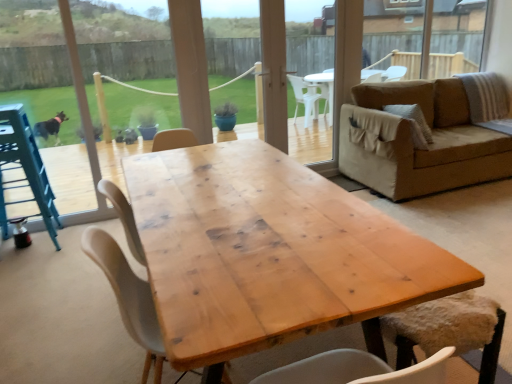
Describe the element at coordinates (128, 297) in the screenshot. Image resolution: width=512 pixels, height=384 pixels. I see `white matte chair at center, which is the second chair in right-to-left order` at that location.

Where is `natural wood table at center`? Image resolution: width=512 pixels, height=384 pixels. natural wood table at center is located at coordinates (270, 254).

Identify the location of transparent plastic screen door at center. The width and height of the screenshot is (512, 384). (274, 73).

Is point (284, 95) positioned behind point (22, 129)?

Yes.

Can you confirm if transparent plastic screen door at center is smaller than metallic blue feeding chair at left?

Correct, transparent plastic screen door at center occupies less space than metallic blue feeding chair at left.

Which of these two, transparent plastic screen door at center or metallic blue feeding chair at left, is wider?

Wider between the two is metallic blue feeding chair at left.

Locate an element on the screen. This screenshot has height=384, width=512. screen door to the right of metallic blue feeding chair at left is located at coordinates (274, 73).

From the image's perspective, is white matte chair at center, which is the second chair in right-to-left order, above or below transparent plastic screen door at center?

From the image's perspective, white matte chair at center, which is the second chair in right-to-left order, appears below transparent plastic screen door at center.

Considering the relative positions of white matte chair at center, which is the second chair in right-to-left order, and transparent plastic screen door at center in the image provided, is white matte chair at center, which is the second chair in right-to-left order, to the right of transparent plastic screen door at center from the viewer's perspective?

In fact, white matte chair at center, which is the second chair in right-to-left order, is to the left of transparent plastic screen door at center.

Looking at this image, considering the relative sizes of white matte chair at center, the first chair in the left-to-right sequence, and transparent plastic screen door at center in the image provided, is white matte chair at center, the first chair in the left-to-right sequence, shorter than transparent plastic screen door at center?

Indeed, white matte chair at center, the first chair in the left-to-right sequence, has a lesser height compared to transparent plastic screen door at center.

Based on the photo, can we say white matte chair at center, which is the second chair in right-to-left order, lies outside transparent plastic screen door at center?

white matte chair at center, which is the second chair in right-to-left order, is positioned outside transparent plastic screen door at center.

Looking at this image, is metallic blue feeding chair at left not within fuzzy white chair at lower right, arranged as the second chair when viewed from the left?

Yes.

The height and width of the screenshot is (384, 512). In order to click on feeding chair located on the left of fuzzy white chair at lower right, arranged as the second chair when viewed from the left in this screenshot , I will do `click(24, 169)`.

Is point (30, 169) positioned in front of point (467, 299)?

That is False.

Considering the positions of point (414, 322) and point (137, 331), is point (414, 322) closer or farther from the camera than point (137, 331)?

Clearly, point (414, 322) is more distant from the camera than point (137, 331).

Could you tell me if fuzzy white chair at lower right, the first chair positioned from the right, is turned towards white matte chair at center, which is the second chair in right-to-left order?

No, fuzzy white chair at lower right, the first chair positioned from the right, is not turned towards white matte chair at center, which is the second chair in right-to-left order.

You are a GUI agent. You are given a task and a screenshot of the screen. Output one action in this format:
    pyautogui.click(x=<x>, y=<y>)
    Task: Click on the chair below the fuzzy white chair at lower right, arranged as the second chair when viewed from the left (from the image's perspective)
    The image size is (512, 384).
    Given the screenshot: What is the action you would take?
    pyautogui.click(x=128, y=297)

Is fuzzy white chair at lower right, arranged as the second chair when viewed from the left, to the left of white matte chair at center, the first chair in the left-to-right sequence, from the viewer's perspective?

No, fuzzy white chair at lower right, arranged as the second chair when viewed from the left, is not to the left of white matte chair at center, the first chair in the left-to-right sequence.

Considering the positions of objects metallic blue feeding chair at left and white matte chair at center, the first chair in the left-to-right sequence, in the image provided, who is more to the right, metallic blue feeding chair at left or white matte chair at center, the first chair in the left-to-right sequence,?

white matte chair at center, the first chair in the left-to-right sequence.

Consider the image. Which object is thinner, metallic blue feeding chair at left or white matte chair at center, which is the second chair in right-to-left order?

With smaller width is metallic blue feeding chair at left.

Looking at this image, considering the relative sizes of metallic blue feeding chair at left and white matte chair at center, which is the second chair in right-to-left order, in the image provided, is metallic blue feeding chair at left smaller than white matte chair at center, which is the second chair in right-to-left order,?

No.

From a real-world perspective, which object stands above the other?

fuzzy white chair at lower right, the first chair positioned from the right.

Who is smaller, white matte chair at center, the first chair in the left-to-right sequence, or fuzzy white chair at lower right, the first chair positioned from the right?

fuzzy white chair at lower right, the first chair positioned from the right, is smaller.

Can you confirm if white matte chair at center, the first chair in the left-to-right sequence, is positioned to the left of fuzzy white chair at lower right, arranged as the second chair when viewed from the left?

Indeed, white matte chair at center, the first chair in the left-to-right sequence, is positioned on the left side of fuzzy white chair at lower right, arranged as the second chair when viewed from the left.

Is natural wood table at center located outside fuzzy white chair at lower right, the first chair positioned from the right?

Yes.

Does point (181, 164) appear closer or farther from the camera than point (395, 326)?

Point (181, 164) is positioned farther from the camera compared to point (395, 326).

How distant is natural wood table at center from fuzzy white chair at lower right, arranged as the second chair when viewed from the left?

25.94 inches.

This screenshot has width=512, height=384. I want to click on feeding chair lying in front of the transparent plastic screen door at center, so click(x=24, y=169).

Find the location of a particular element. the 2nd chair below the transparent plastic screen door at center (from the image's perspective) is located at coordinates (128, 297).

Considering their positions, is transparent plastic screen door at center positioned closer to white matte chair at center, the first chair in the left-to-right sequence, than fuzzy white chair at lower right, the first chair positioned from the right?

fuzzy white chair at lower right, the first chair positioned from the right, is closer to white matte chair at center, the first chair in the left-to-right sequence.

When comparing their distances from white matte chair at center, which is the second chair in right-to-left order, does metallic blue feeding chair at left or fuzzy white chair at lower right, the first chair positioned from the right, seem closer?

fuzzy white chair at lower right, the first chair positioned from the right, is positioned closer to the anchor white matte chair at center, which is the second chair in right-to-left order.

From the image, which object appears to be nearer to natural wood table at center, metallic blue feeding chair at left or white matte chair at center, which is the second chair in right-to-left order?

white matte chair at center, which is the second chair in right-to-left order, is positioned closer to the anchor natural wood table at center.

Based on their spatial positions, is fuzzy white chair at lower right, the first chair positioned from the right, or natural wood table at center closer to white matte chair at center, which is the second chair in right-to-left order?

Based on the image, natural wood table at center appears to be nearer to white matte chair at center, which is the second chair in right-to-left order.

Considering their positions, is natural wood table at center positioned closer to transparent plastic screen door at center than metallic blue feeding chair at left?

metallic blue feeding chair at left.

Looking at the image, which one is located closer to metallic blue feeding chair at left, transparent plastic screen door at center or fuzzy white chair at lower right, arranged as the second chair when viewed from the left?

transparent plastic screen door at center is closer to metallic blue feeding chair at left.

Based on their spatial positions, is natural wood table at center or transparent plastic screen door at center further from fuzzy white chair at lower right, arranged as the second chair when viewed from the left?

Among the two, transparent plastic screen door at center is located further to fuzzy white chair at lower right, arranged as the second chair when viewed from the left.

From the image, which object appears to be nearer to white matte chair at center, which is the second chair in right-to-left order, natural wood table at center or transparent plastic screen door at center?

The object closer to white matte chair at center, which is the second chair in right-to-left order, is natural wood table at center.

What are the coordinates of `chair between metallic blue feeding chair at left and fuzzy white chair at lower right, arranged as the second chair when viewed from the left, in the horizontal direction` in the screenshot? It's located at (128, 297).

Locate an element on the screen. This screenshot has width=512, height=384. feeding chair between white matte chair at center, which is the second chair in right-to-left order, and transparent plastic screen door at center from front to back is located at coordinates (24, 169).

At what (x,y) coordinates should I click in order to perform the action: click on coffee table between white matte chair at center, which is the second chair in right-to-left order, and fuzzy white chair at lower right, the first chair positioned from the right, in the horizontal direction. Please return your answer as a coordinate pair (x, y). Image resolution: width=512 pixels, height=384 pixels. Looking at the image, I should click on (270, 254).

Locate an element on the screen. The image size is (512, 384). chair located between white matte chair at center, the first chair in the left-to-right sequence, and transparent plastic screen door at center in the depth direction is located at coordinates (448, 329).